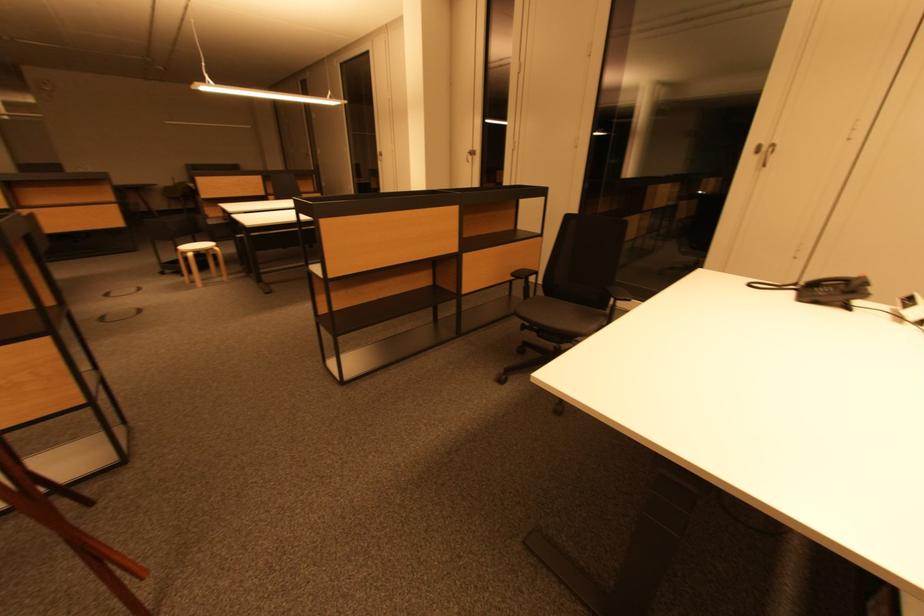
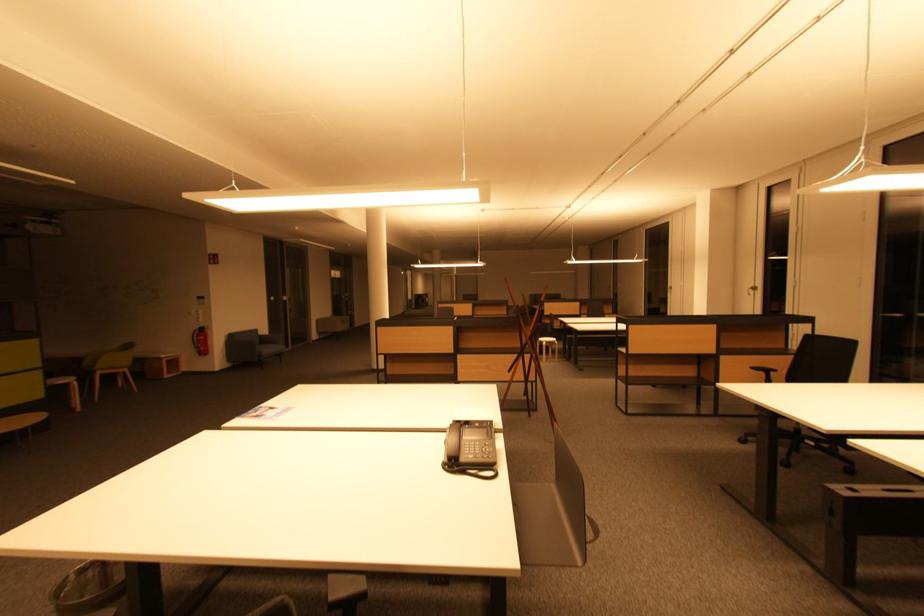
In the second image, find the point that corresponds to point (193, 256) in the first image.

(549, 345)